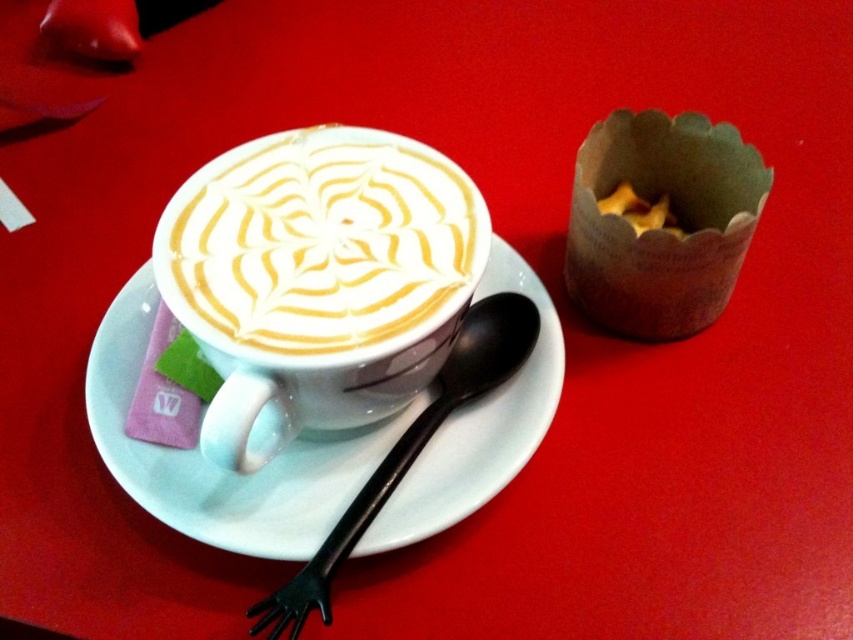
Question: In this image, where is white glossy saucer at center located relative to black plastic spoon at center?

Choices:
 (A) below
 (B) above

Answer: (B)

Question: Which point is farther to the camera?

Choices:
 (A) (142, 472)
 (B) (625, 276)
 (C) (387, 461)

Answer: (B)

Question: Among these points, which one is farthest from the camera?

Choices:
 (A) (537, 321)
 (B) (711, 310)

Answer: (B)

Question: Is white glossy cup at center smaller than black plastic spoon at center?

Choices:
 (A) no
 (B) yes

Answer: (B)

Question: Which point is closer to the camera?

Choices:
 (A) black plastic spoon at center
 (B) brown paper muffin at upper right
 (C) white glossy saucer at center

Answer: (A)

Question: Is white glossy cup at center to the left of black plastic spoon at center from the viewer's perspective?

Choices:
 (A) yes
 (B) no

Answer: (A)